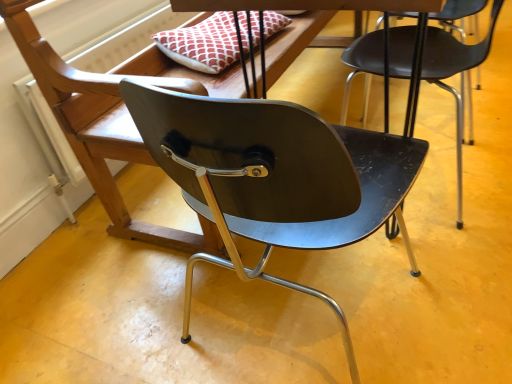
I want to click on free space below matte black chair at center, which is the second chair in right-to-left order (from a real-world perspective), so pos(310,301).